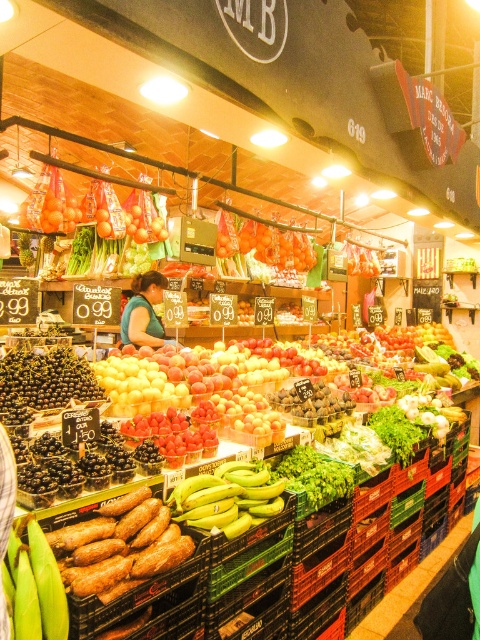
Question: Among these points, which one is nearest to the camera?

Choices:
 (A) (58, 637)
 (B) (148, 193)
 (C) (155, 346)
 (D) (264, 227)

Answer: (A)

Question: Is green matte corn at lower left to the left of green fabric shirt at center from the viewer's perspective?

Choices:
 (A) no
 (B) yes

Answer: (A)

Question: Which of the following is the farthest from the observer?

Choices:
 (A) (142, 276)
 (B) (207, 509)
 (C) (265, 246)
 (D) (164, 225)

Answer: (C)

Question: Is green matte corn at lower left above green fabric shirt at center?

Choices:
 (A) no
 (B) yes

Answer: (A)

Question: Is shiny red tomato at upper left to the left of shiny red tomatoes at center from the viewer's perspective?

Choices:
 (A) no
 (B) yes

Answer: (B)

Question: Considering the real-world distances, which object is closest to the green matte bananas at center?

Choices:
 (A) green fabric shirt at center
 (B) green matte corn at lower left
 (C) shiny red tomatoes at center
 (D) shiny red tomato at upper left

Answer: (B)